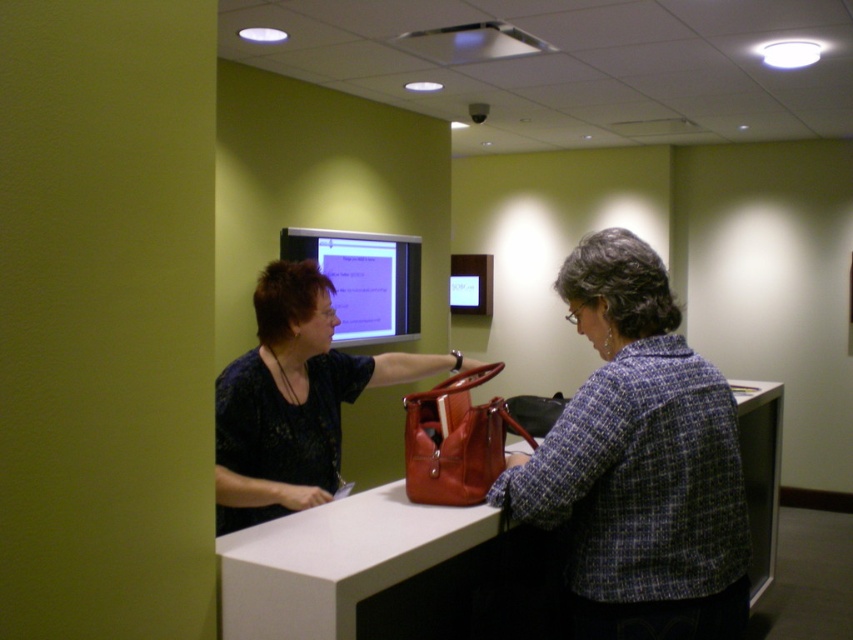
You are a customer trying to place your belongings on the counter. The plaid wool jacket at center and the leather handbag at center are already there. Which item can you move to make more space for your items?

The plaid wool jacket at center occupies less space than the leather handbag at center, so moving the plaid wool jacket at center would free up less space. To make more space, you should move the leather handbag at center since it takes up more room.

You are a customer standing in front of the white counter. You notice two items at the center of the counter. Which item is wider between the plaid wool jacket at center and the matte plastic monitor at center?

The matte plastic monitor at center is wider than the plaid wool jacket at center.